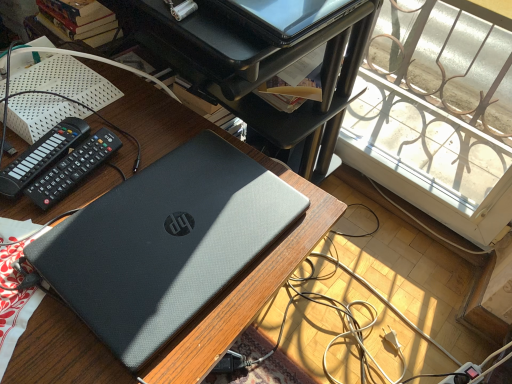
You are a GUI agent. You are given a task and a screenshot of the screen. Output one action in this format:
    pyautogui.click(x=<x>, y=<y>)
    Task: Click on the sleek black laptop at upper center
    
    Given the screenshot: What is the action you would take?
    pyautogui.click(x=284, y=17)

This screenshot has height=384, width=512. What do you see at coordinates (73, 169) in the screenshot?
I see `black plastic remote at upper left, which is counted as the 1th control, starting from the right` at bounding box center [73, 169].

Image resolution: width=512 pixels, height=384 pixels. What do you see at coordinates (42, 155) in the screenshot?
I see `black plastic remote at left, which ranks as the 2th control in right-to-left order` at bounding box center [42, 155].

The image size is (512, 384). Find the location of `sleek black laptop at upper center`. sleek black laptop at upper center is located at coordinates (284, 17).

Is black plastic remote at upper left, which is counted as the 1th control, starting from the right, oriented away from black plastic remote at left, which appears as the 1th control when viewed from the left?

No, black plastic remote at upper left, which is counted as the 1th control, starting from the right, is not facing away from black plastic remote at left, which appears as the 1th control when viewed from the left.

What's the angular difference between black plastic remote at upper left, which is counted as the 1th control, starting from the right, and black plastic remote at left, which ranks as the 2th control in right-to-left order,'s facing directions?

black plastic remote at upper left, which is counted as the 1th control, starting from the right, and black plastic remote at left, which ranks as the 2th control in right-to-left order, are facing 5.64 degrees away from each other.

This screenshot has height=384, width=512. I want to click on control that appears below the black plastic remote at left, which appears as the 1th control when viewed from the left (from the image's perspective), so click(73, 169).

Is black plastic remote at upper left, which is counted as the 1th control, starting from the right, to the left or to the right of black plastic remote at left, which appears as the 1th control when viewed from the left, in the image?

Clearly, black plastic remote at upper left, which is counted as the 1th control, starting from the right, is on the right of black plastic remote at left, which appears as the 1th control when viewed from the left, in the image.

Between matte black laptop at center and black plastic remote at upper left, which is counted as the 1th control, starting from the right, which one has larger size?

matte black laptop at center.

From the image's perspective, is matte black laptop at center positioned above or below black plastic remote at upper left, the 2th control when ordered from left to right?

From the image's perspective, matte black laptop at center appears below black plastic remote at upper left, the 2th control when ordered from left to right.

Is matte black laptop at center in front of or behind black plastic remote at upper left, the 2th control when ordered from left to right, in the image?

Visually, matte black laptop at center is located in front of black plastic remote at upper left, the 2th control when ordered from left to right.

From a real-world perspective, which object rests below the other?

matte black laptop at center.

Can you confirm if sleek black laptop at upper center is positioned to the left of black plastic remote at left, which ranks as the 2th control in right-to-left order?

No.

Considering the points (268, 24) and (47, 143), which point is behind, point (268, 24) or point (47, 143)?

The point (47, 143) is more distant.

Locate an element on the screen. the 2nd control counting from the left side of the sleek black laptop at upper center is located at coordinates (42, 155).

Would you say black plastic remote at left, which ranks as the 2th control in right-to-left order, is to the left or to the right of black plastic remote at upper left, the 2th control when ordered from left to right, in the picture?

black plastic remote at left, which ranks as the 2th control in right-to-left order, is positioned on black plastic remote at upper left, the 2th control when ordered from left to right,'s left side.

Between black plastic remote at left, which ranks as the 2th control in right-to-left order, and black plastic remote at upper left, which is counted as the 1th control, starting from the right, which one has more height?

black plastic remote at upper left, which is counted as the 1th control, starting from the right, is taller.

Is black plastic remote at left, which ranks as the 2th control in right-to-left order, not within black plastic remote at upper left, which is counted as the 1th control, starting from the right?

Yes, black plastic remote at left, which ranks as the 2th control in right-to-left order, is outside of black plastic remote at upper left, which is counted as the 1th control, starting from the right.

Considering the positions of point (51, 132) and point (85, 151), is point (51, 132) closer or farther from the camera than point (85, 151)?

Point (51, 132) is farther from the camera than point (85, 151).

Image resolution: width=512 pixels, height=384 pixels. Find the location of `computer above the matte black laptop at center (from a real-world perspective)`. computer above the matte black laptop at center (from a real-world perspective) is located at coordinates (284, 17).

From the picture: Who is bigger, sleek black laptop at upper center or matte black laptop at center?

With larger size is matte black laptop at center.

Is sleek black laptop at upper center turned away from matte black laptop at center?

No, sleek black laptop at upper center is not facing the opposite direction of matte black laptop at center.

Can you confirm if sleek black laptop at upper center is thinner than matte black laptop at center?

Yes.

In the image, is sleek black laptop at upper center positioned in front of or behind black plastic remote at upper left, which is counted as the 1th control, starting from the right?

sleek black laptop at upper center is behind black plastic remote at upper left, which is counted as the 1th control, starting from the right.

Is sleek black laptop at upper center spatially inside black plastic remote at upper left, which is counted as the 1th control, starting from the right, or outside of it?

sleek black laptop at upper center is located beyond the bounds of black plastic remote at upper left, which is counted as the 1th control, starting from the right.

Between sleek black laptop at upper center and black plastic remote at upper left, the 2th control when ordered from left to right, which one appears on the right side from the viewer's perspective?

sleek black laptop at upper center.

Would you say sleek black laptop at upper center is part of black plastic remote at left, which ranks as the 2th control in right-to-left order,'s contents?

No.

Is black plastic remote at left, which ranks as the 2th control in right-to-left order, shorter than sleek black laptop at upper center?

Indeed, black plastic remote at left, which ranks as the 2th control in right-to-left order, has a lesser height compared to sleek black laptop at upper center.

Is black plastic remote at left, which ranks as the 2th control in right-to-left order, beside sleek black laptop at upper center?

No, black plastic remote at left, which ranks as the 2th control in right-to-left order, is not with sleek black laptop at upper center.

In order to click on control in front of the black plastic remote at left, which appears as the 1th control when viewed from the left in this screenshot , I will do `click(73, 169)`.

This screenshot has height=384, width=512. I want to click on the 1st control above the matte black laptop at center (from the image's perspective), so click(73, 169).

Based on the photo, when comparing their distances from sleek black laptop at upper center, does black plastic remote at left, which appears as the 1th control when viewed from the left, or black plastic remote at upper left, the 2th control when ordered from left to right, seem closer?

Based on the image, black plastic remote at upper left, the 2th control when ordered from left to right, appears to be nearer to sleek black laptop at upper center.

Looking at the image, which one is located further to black plastic remote at left, which ranks as the 2th control in right-to-left order, sleek black laptop at upper center or matte black laptop at center?

Among the two, sleek black laptop at upper center is located further to black plastic remote at left, which ranks as the 2th control in right-to-left order.

Looking at the image, which one is located further to black plastic remote at upper left, the 2th control when ordered from left to right, matte black laptop at center or black plastic remote at left, which ranks as the 2th control in right-to-left order?

matte black laptop at center is positioned further to the anchor black plastic remote at upper left, the 2th control when ordered from left to right.

Which object lies nearer to the anchor point black plastic remote at left, which appears as the 1th control when viewed from the left, black plastic remote at upper left, the 2th control when ordered from left to right, or sleek black laptop at upper center?

Among the two, black plastic remote at upper left, the 2th control when ordered from left to right, is located nearer to black plastic remote at left, which appears as the 1th control when viewed from the left.

Looking at the image, which one is located closer to black plastic remote at upper left, the 2th control when ordered from left to right, black plastic remote at left, which ranks as the 2th control in right-to-left order, or sleek black laptop at upper center?

black plastic remote at left, which ranks as the 2th control in right-to-left order.

Looking at the image, which one is located further to sleek black laptop at upper center, black plastic remote at upper left, the 2th control when ordered from left to right, or black plastic remote at left, which appears as the 1th control when viewed from the left?

The object further to sleek black laptop at upper center is black plastic remote at left, which appears as the 1th control when viewed from the left.

Estimate the real-world distances between objects in this image. Which object is closer to black plastic remote at upper left, the 2th control when ordered from left to right, black plastic remote at left, which ranks as the 2th control in right-to-left order, or matte black laptop at center?

black plastic remote at left, which ranks as the 2th control in right-to-left order.

When comparing their distances from matte black laptop at center, does black plastic remote at left, which appears as the 1th control when viewed from the left, or sleek black laptop at upper center seem closer?

The object closer to matte black laptop at center is black plastic remote at left, which appears as the 1th control when viewed from the left.

At what (x,y) coordinates should I click in order to perform the action: click on control between black plastic remote at left, which ranks as the 2th control in right-to-left order, and matte black laptop at center in the up-down direction. Please return your answer as a coordinate pair (x, y). This screenshot has width=512, height=384. Looking at the image, I should click on tap(73, 169).

Locate an element on the screen. control between black plastic remote at left, which appears as the 1th control when viewed from the left, and sleek black laptop at upper center from left to right is located at coordinates (73, 169).